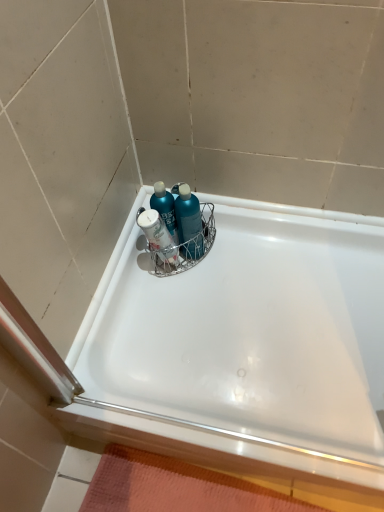
At what (x,y) coordinates should I click in order to perform the action: click on vacant region above orange textured bath mat at bottom (from a real-world perspective). Please return your answer as a coordinate pair (x, y). The height and width of the screenshot is (512, 384). Looking at the image, I should click on (204, 489).